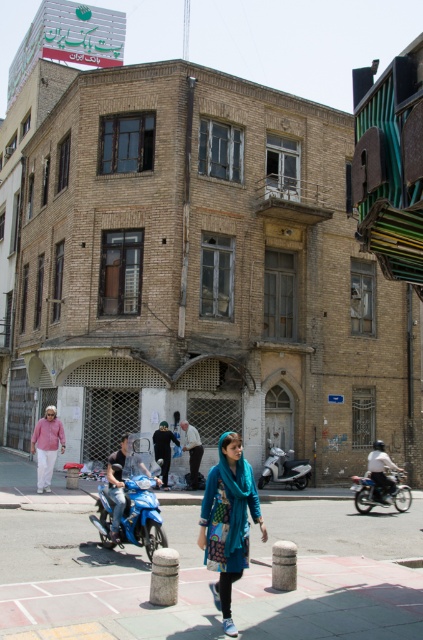
Question: Can you confirm if matte pink sweater at lower left is bigger than blue fabric jacket at center?

Choices:
 (A) yes
 (B) no

Answer: (B)

Question: Does matte pink sweater at lower left have a greater width compared to light brown leather jacket at center?

Choices:
 (A) yes
 (B) no

Answer: (A)

Question: Observing the image, what is the correct spatial positioning of blue fabric jacket at center in reference to dark blue fabric jacket at center?

Choices:
 (A) left
 (B) right

Answer: (A)

Question: Which point is farther to the camera?

Choices:
 (A) teal fabric scarf at center
 (B) blue fabric jacket at center
 (C) shiny blue motorcycle at center
 (D) matte pink sweater at lower left

Answer: (D)

Question: Estimate the real-world distances between objects in this image. Which object is closer to the metallic silver scooter at center?

Choices:
 (A) matte pink sweater at lower left
 (B) metallic blue motorcycle at right

Answer: (B)

Question: Which point is closer to the camera?

Choices:
 (A) (159, 451)
 (B) (370, 493)
 (C) (139, 467)
 (D) (280, 474)

Answer: (C)